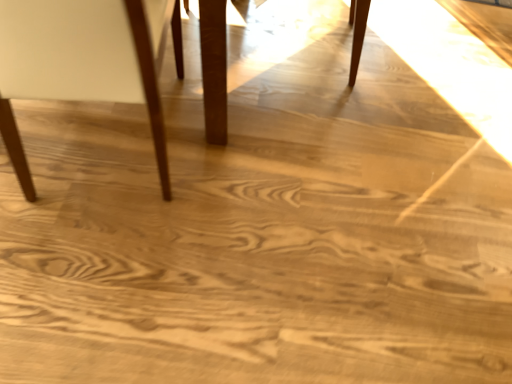
Image resolution: width=512 pixels, height=384 pixels. What are the coordinates of `vacant space in front of wooden chair leg at left` in the screenshot? It's located at (104, 280).